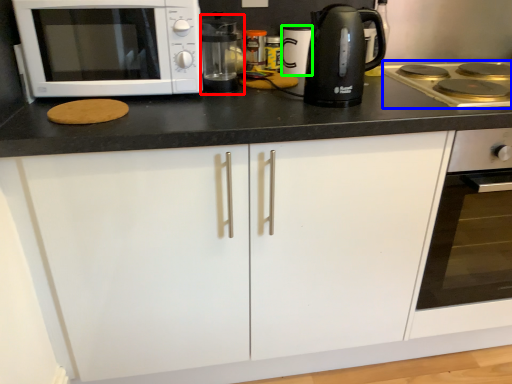
Question: Which object is the farthest from coffee machine (highlighted by a red box)? Choose among these: gas stove (highlighted by a blue box) or appliance (highlighted by a green box).

Choices:
 (A) gas stove
 (B) appliance

Answer: (A)